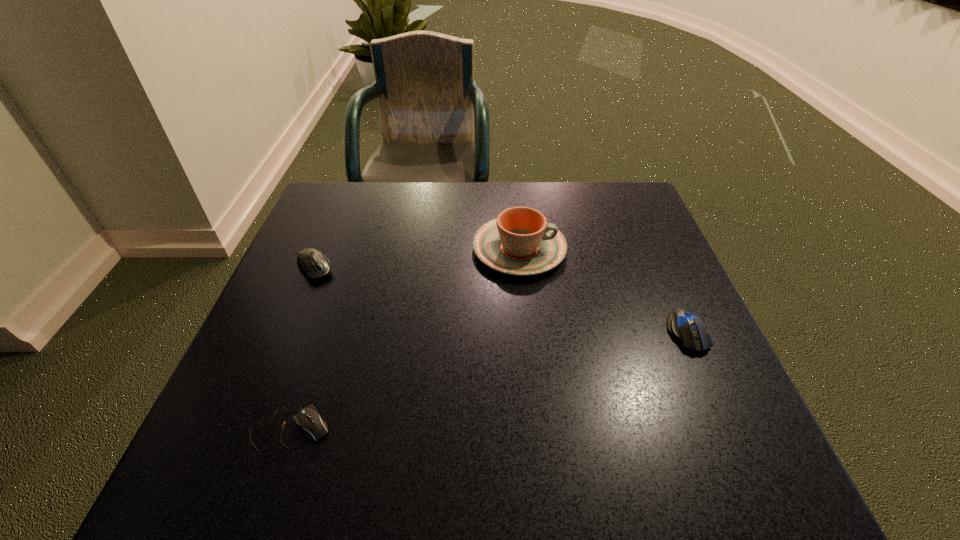
Image resolution: width=960 pixels, height=540 pixels. What are the coordinates of `unoccupied position between the third tallest object and the farthest computer mouse` in the screenshot? It's located at (501, 301).

Where is `blank region between the second object from right to left and the shortest object`? The width and height of the screenshot is (960, 540). blank region between the second object from right to left and the shortest object is located at coordinates (405, 338).

Image resolution: width=960 pixels, height=540 pixels. Identify the location of object that stands as the third closest to the second object from right to left. pos(308,418).

Locate an element on the screen. object that is the third nearest to the tallest computer mouse is located at coordinates (683, 325).

The width and height of the screenshot is (960, 540). What are the coordinates of `computer mouse that is the second closest to the third object from left to right` in the screenshot? It's located at (315, 265).

You are a GUI agent. You are given a task and a screenshot of the screen. Output one action in this format:
    pyautogui.click(x=<x>, y=<y>)
    Task: Click on the second closest computer mouse relative to the second farthest computer mouse
    Image resolution: width=960 pixels, height=540 pixels.
    Given the screenshot: What is the action you would take?
    pyautogui.click(x=315, y=265)